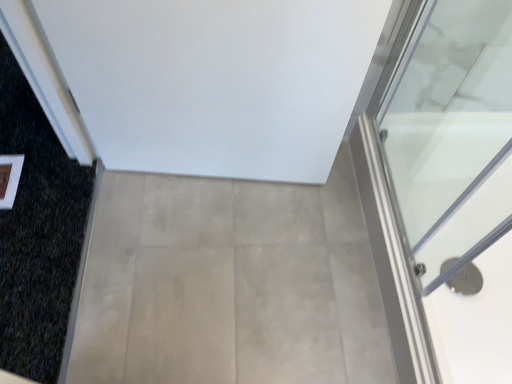
Question: Should I look upward or downward to see transparent glass door at right?

Choices:
 (A) down
 (B) up

Answer: (A)